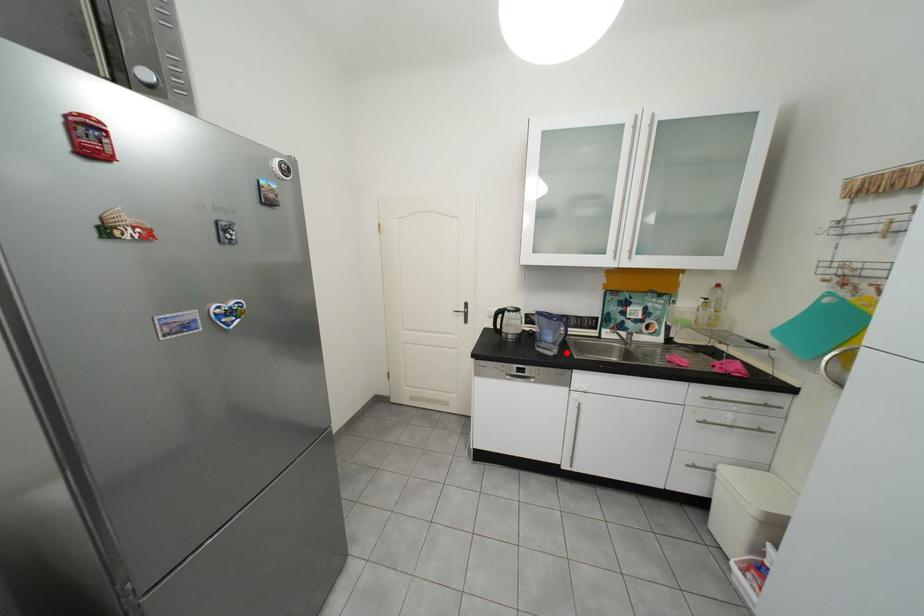
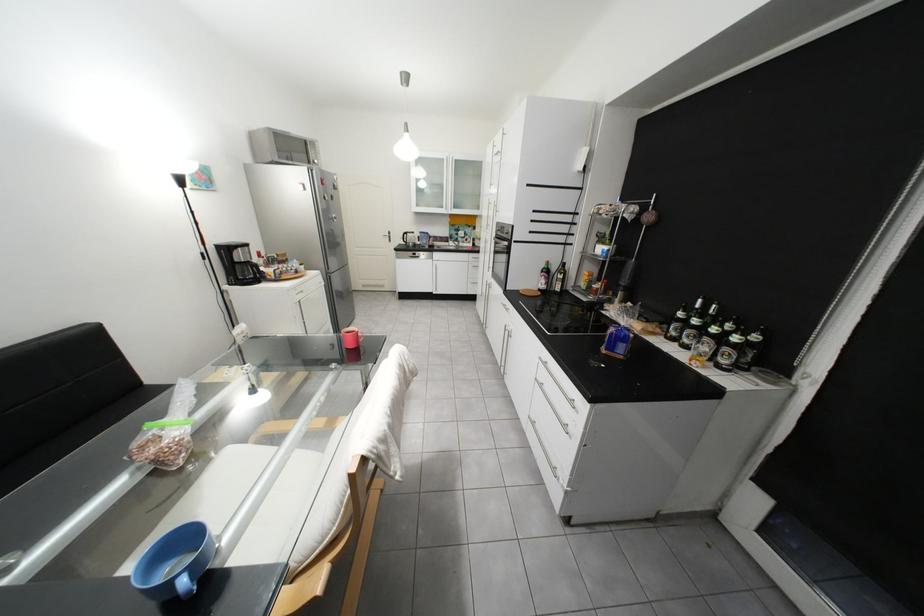
Question: I am providing you with two images of the same scene from different viewpoints. Given a red point in image1, look at the same physical point in image2. Is it:

Choices:
 (A) Closer to the viewpoint
 (B) Farther from the viewpoint

Answer: (A)